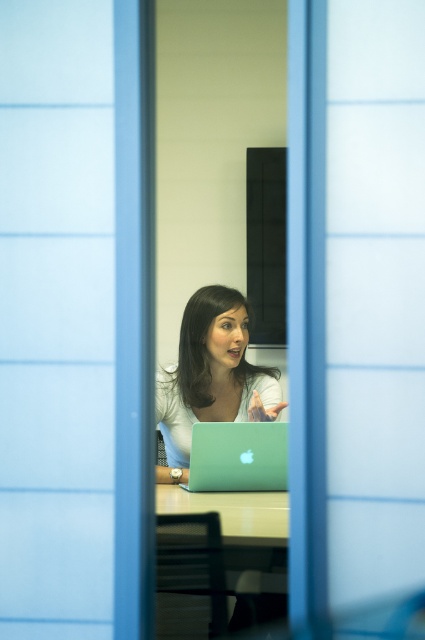
Which is more to the left, green matte laptop at center or light brown wooden table at center?

light brown wooden table at center is more to the left.

What do you see at coordinates (238, 456) in the screenshot?
I see `green matte laptop at center` at bounding box center [238, 456].

Measure the distance between point (223,468) and camera.

Point (223,468) is 7.67 feet away from camera.

You are a GUI agent. You are given a task and a screenshot of the screen. Output one action in this format:
    pyautogui.click(x=<x>, y=<y>)
    Task: Click on the green matte laptop at center
    This screenshot has width=425, height=640.
    Given the screenshot: What is the action you would take?
    pyautogui.click(x=238, y=456)

Can you confirm if green glossy table at center is positioned below matte green laptop at center?

Correct, green glossy table at center is located below matte green laptop at center.

Between point (272, 595) and point (274, 419), which one is positioned behind?

The point (274, 419) is more distant.

This screenshot has width=425, height=640. I want to click on green glossy table at center, so click(x=217, y=554).

Does green glossy table at center have a smaller size compared to light brown wooden table at center?

Result: No, green glossy table at center is not smaller than light brown wooden table at center.

At what (x,y) coordinates should I click in order to perform the action: click on green glossy table at center. Please return your answer as a coordinate pair (x, y). Looking at the image, I should click on (217, 554).

Identify the location of green glossy table at center. (217, 554).